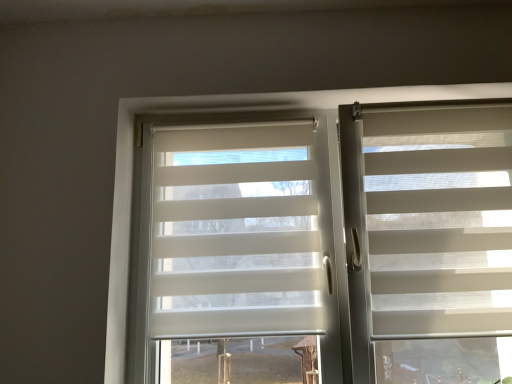
Question: Does white textured blind at right have a greater height compared to white translucent blinds at center?

Choices:
 (A) yes
 (B) no

Answer: (B)

Question: Does white textured blind at right have a greater width compared to white translucent blinds at center?

Choices:
 (A) no
 (B) yes

Answer: (A)

Question: Can you confirm if white textured blind at right is shorter than white translucent blinds at center?

Choices:
 (A) no
 (B) yes

Answer: (B)

Question: Can you confirm if white textured blind at right is smaller than white translucent blinds at center?

Choices:
 (A) yes
 (B) no

Answer: (A)

Question: Is white textured blind at right positioned with its back to white translucent blinds at center?

Choices:
 (A) no
 (B) yes

Answer: (B)

Question: Visually, is white translucent roller shade at center positioned to the left or to the right of white translucent blinds at center?

Choices:
 (A) left
 (B) right

Answer: (A)

Question: Is point (201, 296) closer or farther from the camera than point (287, 288)?

Choices:
 (A) closer
 (B) farther

Answer: (A)

Question: Considering the positions of white translucent roller shade at center and white translucent blinds at center in the image, is white translucent roller shade at center wider or thinner than white translucent blinds at center?

Choices:
 (A) wide
 (B) thin

Answer: (B)

Question: Relative to white translucent blinds at center, is white translucent roller shade at center in front or behind?

Choices:
 (A) behind
 (B) front

Answer: (A)

Question: In terms of width, does white translucent blinds at center look wider or thinner when compared to white textured blind at right?

Choices:
 (A) thin
 (B) wide

Answer: (B)

Question: From a real-world perspective, is white translucent blinds at center positioned above or below white textured blind at right?

Choices:
 (A) above
 (B) below

Answer: (B)

Question: Is white translucent blinds at center inside or outside of white textured blind at right?

Choices:
 (A) inside
 (B) outside

Answer: (B)

Question: Is point (157, 279) positioned closer to the camera than point (408, 205)?

Choices:
 (A) farther
 (B) closer

Answer: (A)

Question: In the image, is white translucent blinds at center positioned in front of or behind white translucent roller shade at center?

Choices:
 (A) behind
 (B) front

Answer: (B)

Question: Which is correct: white translucent blinds at center is inside white translucent roller shade at center, or outside of it?

Choices:
 (A) inside
 (B) outside

Answer: (B)